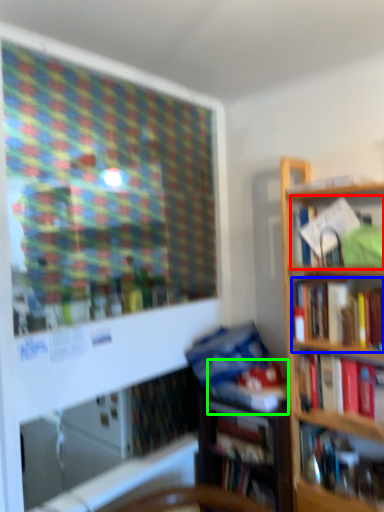
Question: Estimate the real-world distances between objects in this image. Which object is farther from book (highlighted by a red box), book (highlighted by a blue box) or book (highlighted by a green box)?

Choices:
 (A) book
 (B) book

Answer: (B)